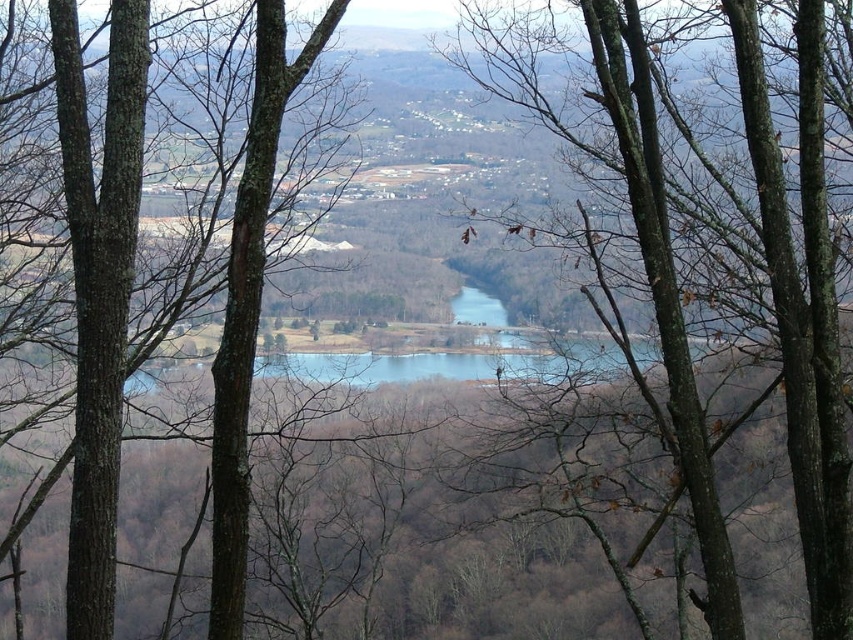
You are an artist planning to paint the valley scene. You want to emphasize the size difference between the brown rough bark tree at center and the brown rough tree at left. Which tree should you paint larger in your artwork?

You should paint the brown rough bark tree at center larger than the brown rough tree at left because it is bigger in the scene.

You are standing at the top of the hill looking down at the valley. You notice the brown rough bark tree at center. Based on its 2D coordinates, where is it located in the image?

The brown rough bark tree at center is located at the 2D coordinates point (x=712, y=252) in the image.

You are standing at the highest point of the hill and looking down at the valley. There is a point marked at coordinates (712, 252). What object is located at that point?

The point at (712, 252) corresponds to the brown rough bark tree at center.